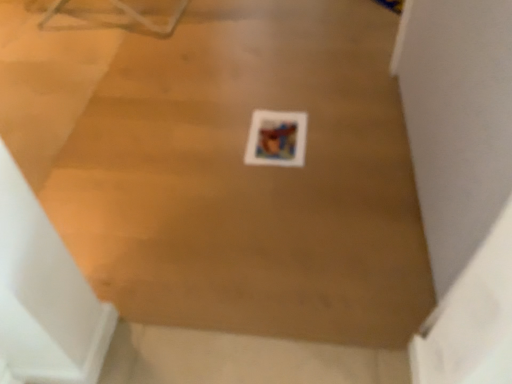
Question: Considering the relative sizes of wooden floor at center and matte paper print at center in the image provided, is wooden floor at center bigger than matte paper print at center?

Choices:
 (A) yes
 (B) no

Answer: (A)

Question: Is the position of wooden floor at center more distant than that of matte paper print at center?

Choices:
 (A) no
 (B) yes

Answer: (A)

Question: From a real-world perspective, is wooden floor at center below matte paper print at center?

Choices:
 (A) no
 (B) yes

Answer: (B)

Question: Is wooden floor at center positioned with its back to matte paper print at center?

Choices:
 (A) no
 (B) yes

Answer: (A)

Question: Does wooden floor at center have a greater width compared to matte paper print at center?

Choices:
 (A) yes
 (B) no

Answer: (A)

Question: Does wooden floor at center have a smaller size compared to matte paper print at center?

Choices:
 (A) yes
 (B) no

Answer: (B)

Question: Can you confirm if matte paper print at center is bigger than wooden floor at center?

Choices:
 (A) yes
 (B) no

Answer: (B)

Question: From a real-world perspective, is matte paper print at center under wooden floor at center?

Choices:
 (A) yes
 (B) no

Answer: (B)

Question: Is matte paper print at center looking in the opposite direction of wooden floor at center?

Choices:
 (A) yes
 (B) no

Answer: (A)

Question: Does matte paper print at center have a lesser height compared to wooden floor at center?

Choices:
 (A) no
 (B) yes

Answer: (B)

Question: Is matte paper print at center further to camera compared to wooden floor at center?

Choices:
 (A) no
 (B) yes

Answer: (B)

Question: From a real-world perspective, is matte paper print at center on wooden floor at center?

Choices:
 (A) no
 (B) yes

Answer: (B)

Question: In the image, is matte paper print at center on the left side or the right side of wooden floor at center?

Choices:
 (A) left
 (B) right

Answer: (B)